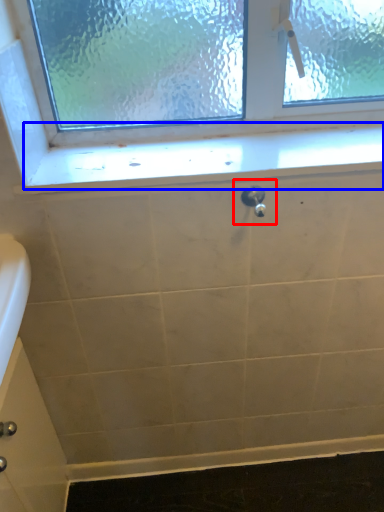
Question: Which of the following is the closest to the observer, plumbing fixture (highlighted by a red box) or window sill (highlighted by a blue box)?

Choices:
 (A) plumbing fixture
 (B) window sill

Answer: (A)